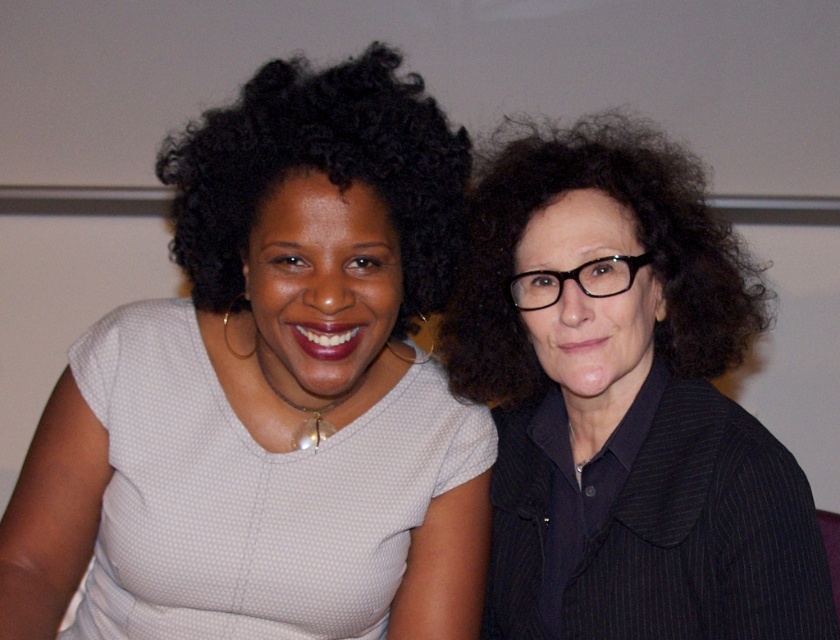
Question: Which object is closer to the camera taking this photo?

Choices:
 (A) matte white blouse at center
 (B) curly dark brown hair at right
 (C) black pinstriped blazer at right

Answer: (A)

Question: Is matte white blouse at center wider than curly dark brown hair at right?

Choices:
 (A) no
 (B) yes

Answer: (B)

Question: Does matte white blouse at center have a larger size compared to black pinstriped blazer at right?

Choices:
 (A) no
 (B) yes

Answer: (B)

Question: Which point appears farthest from the camera in this image?

Choices:
 (A) (507, 205)
 (B) (195, 285)
 (C) (820, 548)

Answer: (A)

Question: Which point is farther to the camera?

Choices:
 (A) (213, 298)
 (B) (659, 544)
 (C) (378, 116)
 (D) (533, 282)

Answer: (D)

Question: Is matte white blouse at center below black curly hair at upper left?

Choices:
 (A) no
 (B) yes

Answer: (B)